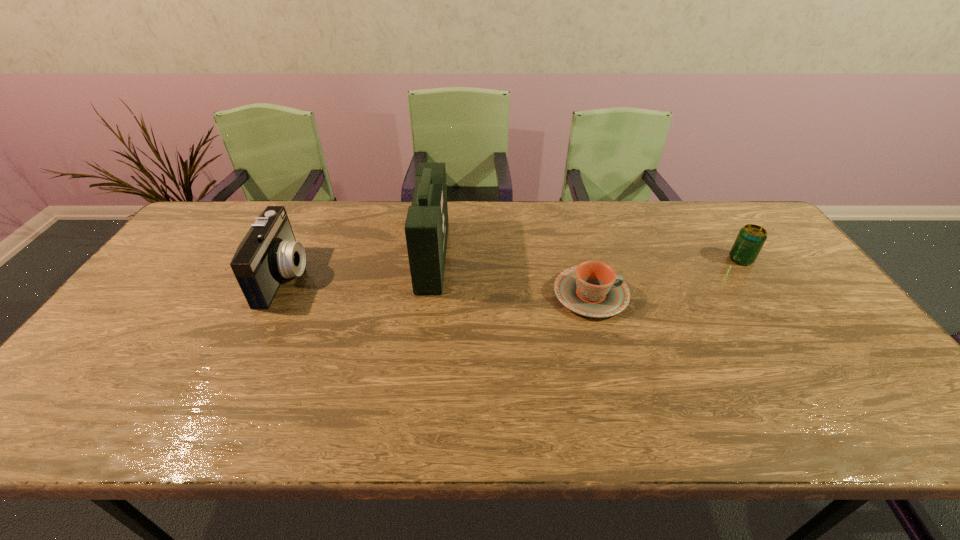
Find the location of a particular element. the tallest object is located at coordinates pyautogui.click(x=426, y=228).

This screenshot has height=540, width=960. I want to click on the third object from right to left, so click(426, 228).

Identify the location of the third shortest object. (269, 252).

Where is `the leftmost object`? Image resolution: width=960 pixels, height=540 pixels. the leftmost object is located at coordinates (269, 252).

The width and height of the screenshot is (960, 540). I want to click on the rightmost object, so click(x=751, y=238).

Find the location of a particular element. The image size is (960, 540). the second shortest object is located at coordinates (751, 238).

Locate an element on the screen. This screenshot has width=960, height=540. the second object from right to left is located at coordinates (592, 289).

The image size is (960, 540). In order to click on chinaware in this screenshot , I will do `click(592, 289)`.

Locate an element on the screen. The height and width of the screenshot is (540, 960). vacant space situated on the front-facing side of the tallest object is located at coordinates pyautogui.click(x=478, y=257).

You are a GUI agent. You are given a task and a screenshot of the screen. Output one action in this format:
    pyautogui.click(x=<x>, y=<y>)
    Task: Click on the vacant area situated on the lens of the third shortest object
    This screenshot has width=960, height=540.
    Given the screenshot: What is the action you would take?
    pyautogui.click(x=401, y=276)